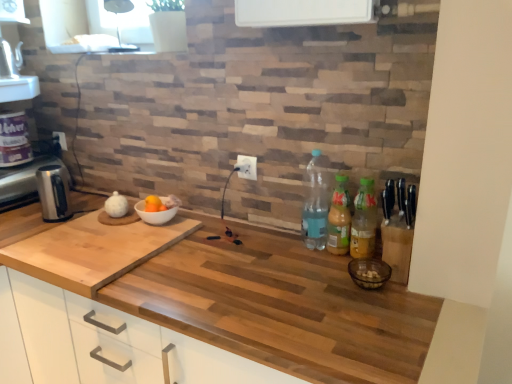
This screenshot has height=384, width=512. In order to click on free space to the left of translucent plastic bottle at right, which ranks as the 1th bottle in left-to-right order in this screenshot , I will do `click(267, 249)`.